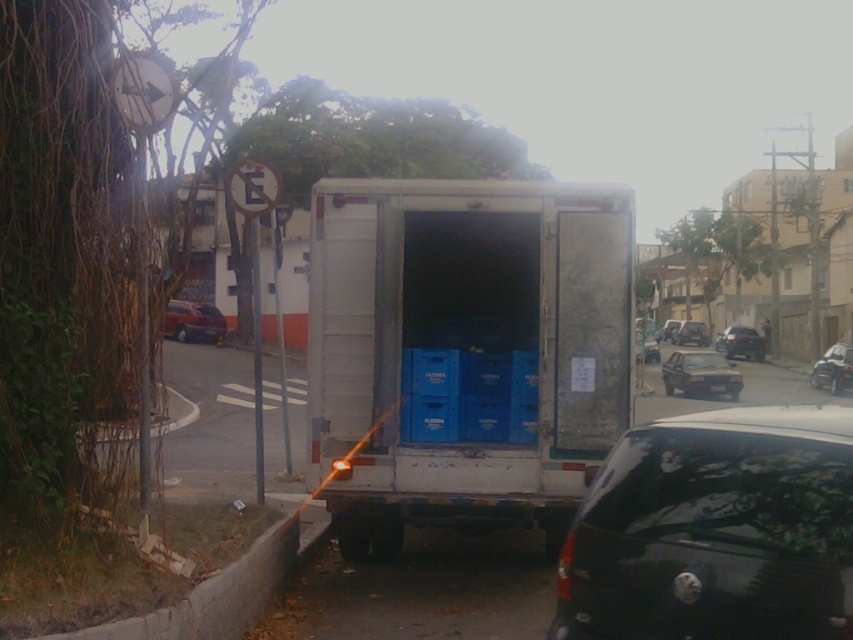
You are a pedestrian standing on the sidewalk and want to cross the street to reach the white delivery truck. There are two vehicles in your path, a black glossy minivan at lower right and a metallic silver car at center. Which vehicle is closer to the curb on the right side of the street?

The black glossy minivan at lower right is positioned on the left side of metallic silver car at center, so the metallic silver car at center is closer to the curb on the right side of the street.

Based on the photo, you are a parking attendant and need to fit both the black glossy minivan at lower right and the metallic silver car at center into a parking spot that is 5 meters long. Can both vehicles fit side by side in the parking spot?

The black glossy minivan at lower right is shorter than the metallic silver car at center. However, without knowing the exact lengths of both vehicles, it is impossible to determine if their combined length will fit within the 5 meter parking spot.